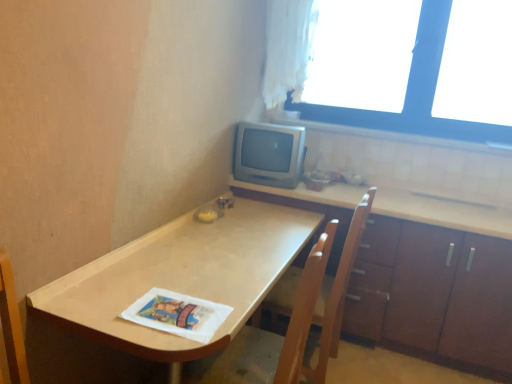
Find the location of a particular element. This screenshot has height=384, width=512. vacant space situated above brown wood cabinet at lower right (from a real-world perspective) is located at coordinates (394, 201).